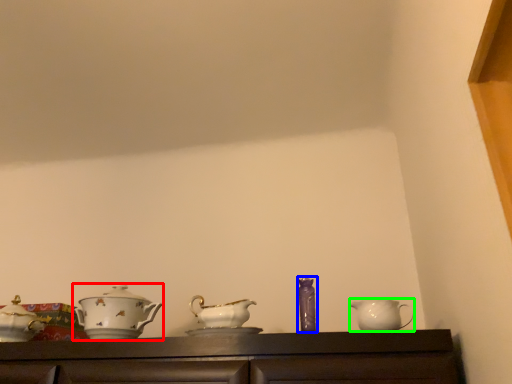
Question: Estimate the real-world distances between objects in this image. Which object is closer to tableware (highlighted by a red box), tableware (highlighted by a blue box) or jug (highlighted by a green box)?

Choices:
 (A) tableware
 (B) jug

Answer: (A)